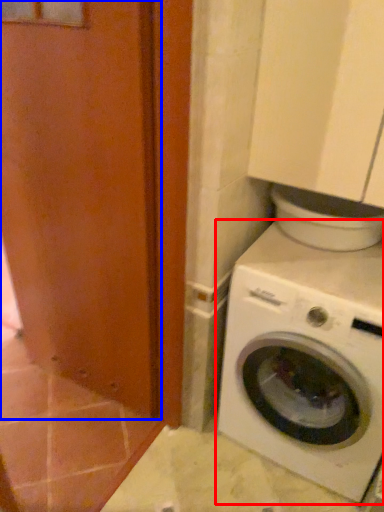
Question: Which object is further to the camera taking this photo, washing machine (highlighted by a red box) or screen door (highlighted by a blue box)?

Choices:
 (A) washing machine
 (B) screen door

Answer: (A)